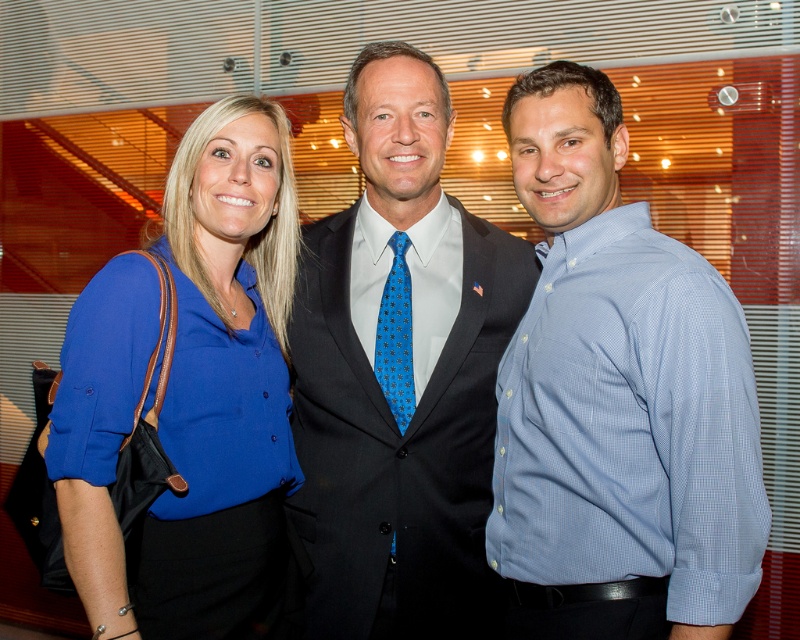
Looking at this image, you are organizing a photo shoot and need to arrange these two shirts in a display case. The case has a shelf that can only accommodate items up to 12 inches in width. According to the description, can both the blue checkered shirt at right and the blue fabric shirt at center fit on the shelf without overlapping?

The blue checkered shirt at right might be wider than the blue fabric shirt at center, but since the exact width isn not provided, it is uncertain if both can fit on the 12 inch shelf without overlapping.

You are a photographer at the event and want to ensure that both the blue checkered shirt at right and the blue dotted tie at center are clearly visible in the photo. Based on their positions, which one is closer to the camera?

The blue checkered shirt at right is in front of the blue dotted tie at center, so it is closer to the camera.

From the picture: Which object is located at the coordinates point (x=617, y=400)?

The blue checkered shirt at right is located at point (x=617, y=400).